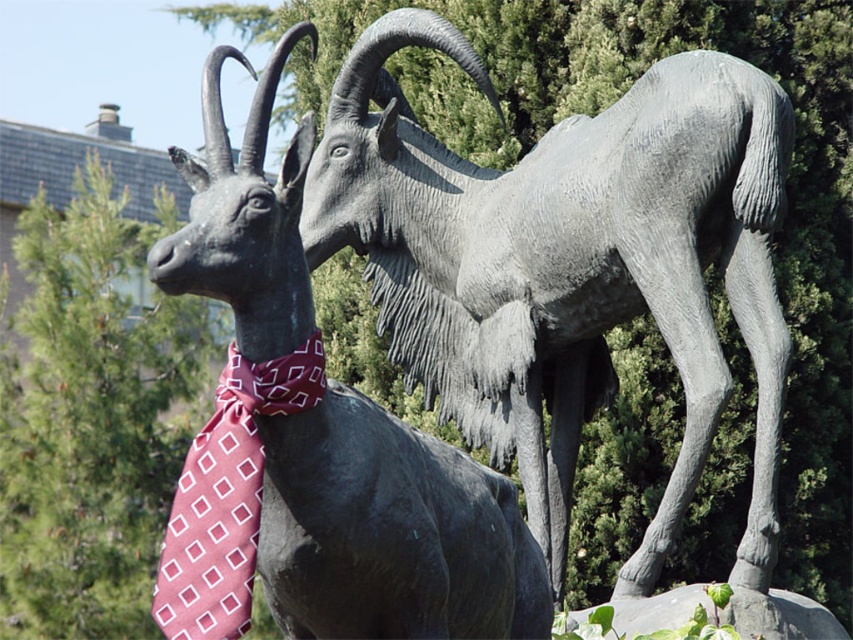
Is matte gray goat at center closer to the viewer compared to maroon silk tie at center?

No, matte gray goat at center is behind maroon silk tie at center.

Does matte gray goat at center appear on the left side of maroon silk tie at center?

In fact, matte gray goat at center is to the right of maroon silk tie at center.

Is point (753, 525) positioned in front of point (239, 396)?

No, it is not.

Where is `matte gray goat at center`? matte gray goat at center is located at coordinates (567, 264).

Which of these two, matte black goat at center or maroon silk tie at center, stands taller?

maroon silk tie at center

Is point (311, 548) positioned before point (193, 618)?

No, it is behind (193, 618).

The image size is (853, 640). Identify the location of matte black goat at center. (316, 442).

Does matte gray goat at center have a lesser width compared to matte black goat at center?

No, matte gray goat at center is not thinner than matte black goat at center.

Is point (492, 310) more distant than point (338, 456)?

Yes, point (492, 310) is behind point (338, 456).

Who is more distant from viewer, (643, 257) or (283, 486)?

Positioned behind is point (643, 257).

The image size is (853, 640). What are the coordinates of `matte gray goat at center` in the screenshot? It's located at (567, 264).